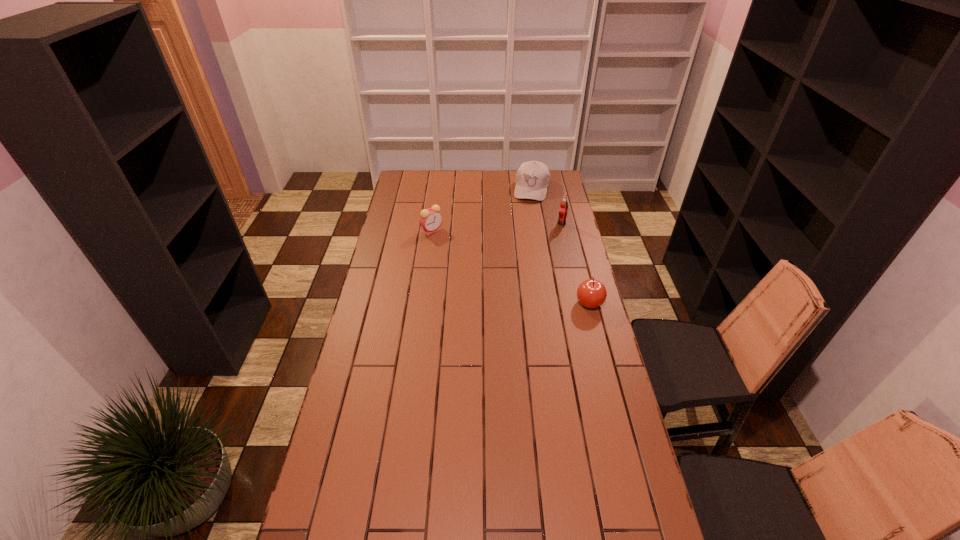
This screenshot has height=540, width=960. Identify the location of object that ranks as the third closest to the farthest object. (591, 293).

Find the location of a particular element. object that stands as the second closest to the baseball cap is located at coordinates (430, 219).

The image size is (960, 540). Identify the location of free space that satisfies the following two spatial constraints: 1. on the face of the alarm clock; 2. on the right side of the apple. (422, 303).